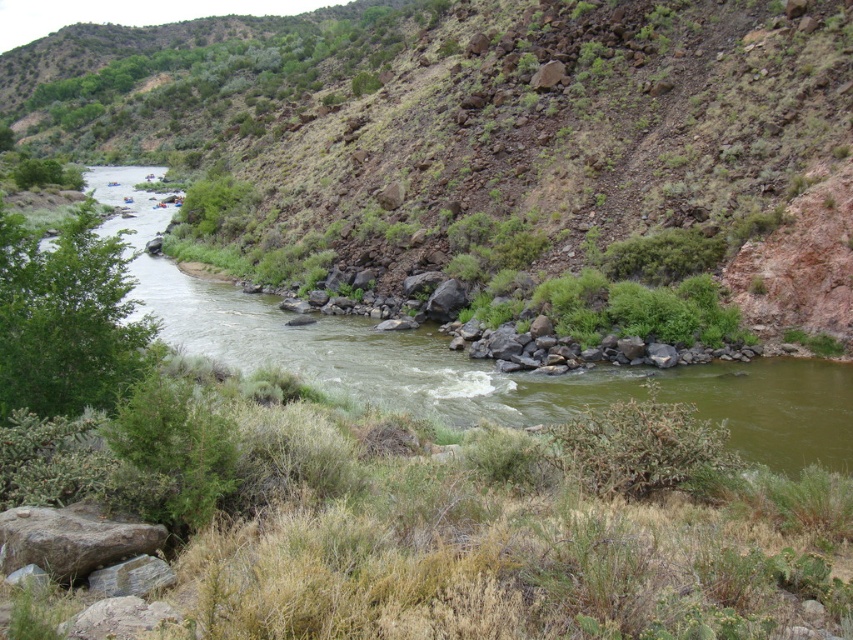
Question: Can you confirm if green grassy hillside at upper left is smaller than green water at left?

Choices:
 (A) yes
 (B) no

Answer: (B)

Question: Is green grassy hillside at upper left to the left of green water at left from the viewer's perspective?

Choices:
 (A) yes
 (B) no

Answer: (A)

Question: Which of the following is the closest to the observer?

Choices:
 (A) green water at left
 (B) green grassy hillside at upper left

Answer: (A)

Question: Is green grassy hillside at upper left positioned before green water at left?

Choices:
 (A) yes
 (B) no

Answer: (B)